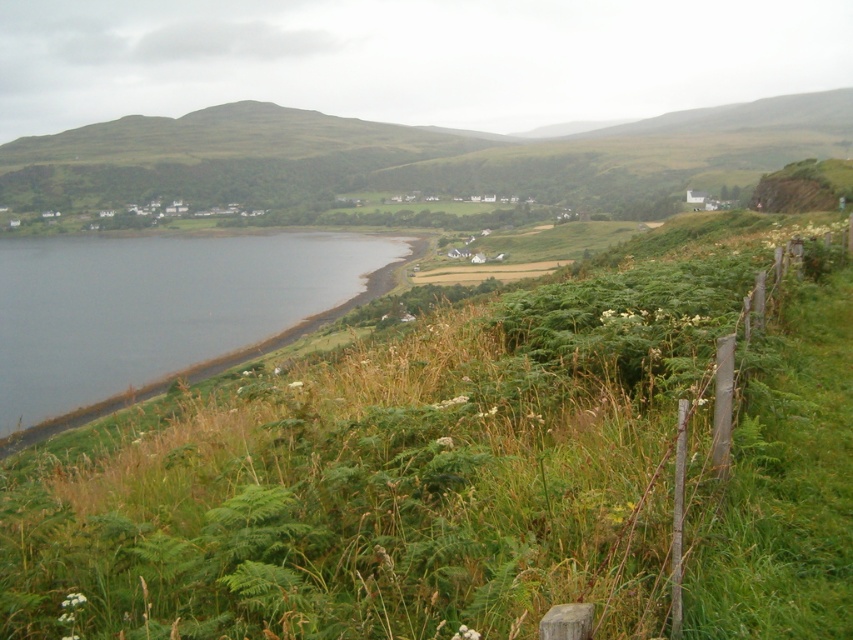
Is dark gray water at lower left wider than wooden post fence at right?

Correct, the width of dark gray water at lower left exceeds that of wooden post fence at right.

Image resolution: width=853 pixels, height=640 pixels. I want to click on dark gray water at lower left, so click(x=160, y=310).

I want to click on dark gray water at lower left, so click(160, 310).

This screenshot has height=640, width=853. In order to click on dark gray water at lower left in this screenshot , I will do `click(160, 310)`.

Is point (778, 320) less distant than point (787, 394)?

That is False.

Who is more distant from viewer, (485, 518) or (741, 435)?

The point (741, 435) is more distant.

You are a GUI agent. You are given a task and a screenshot of the screen. Output one action in this format:
    pyautogui.click(x=<x>, y=<y>)
    Task: Click on the green grassy at lower left
    
    Given the screenshot: What is the action you would take?
    pyautogui.click(x=473, y=468)

Where is `green grassy at lower left`? The width and height of the screenshot is (853, 640). green grassy at lower left is located at coordinates (473, 468).

Is green grassy at lower left above dark gray water at lower left?

No, green grassy at lower left is not above dark gray water at lower left.

Between green grassy at lower left and dark gray water at lower left, which one is positioned lower?

green grassy at lower left is lower down.

Find the location of a particular element. green grassy at lower left is located at coordinates (473, 468).